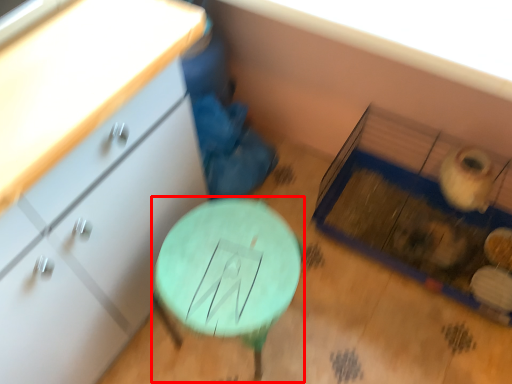
Question: Observing the image, what is the correct spatial positioning of table (annotated by the red box) in reference to chest of drawers?

Choices:
 (A) left
 (B) right

Answer: (B)